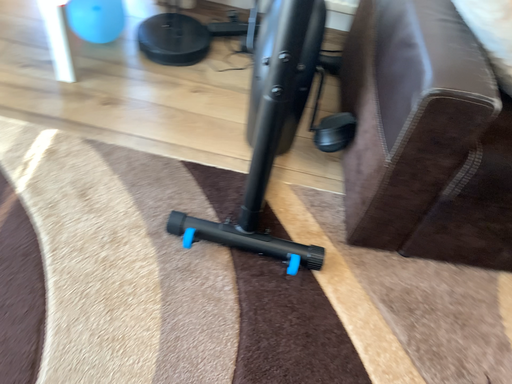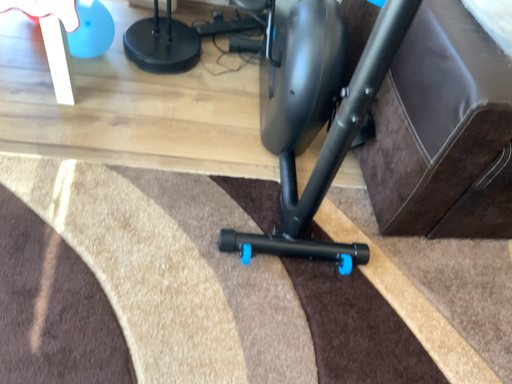
Question: How did the camera likely rotate when shooting the video?

Choices:
 (A) rotated left
 (B) rotated right

Answer: (B)